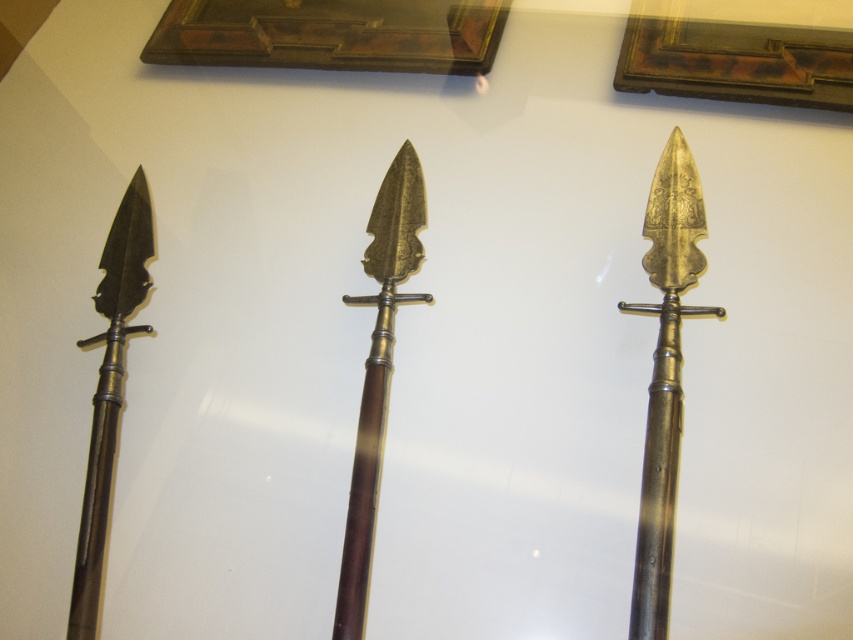
Question: Which is nearer to the gold polished metal spear at center?

Choices:
 (A) matte black spear at left
 (B) gold polished spear at right

Answer: (A)

Question: Does gold polished metal spear at center lie in front of matte black spear at left?

Choices:
 (A) yes
 (B) no

Answer: (A)

Question: Which is farther from the gold polished spear at right?

Choices:
 (A) gold polished metal spear at center
 (B) matte black spear at left

Answer: (B)

Question: Which object is farther from the camera taking this photo?

Choices:
 (A) gold polished metal spear at center
 (B) gold polished spear at right

Answer: (A)

Question: From the image, what is the correct spatial relationship of gold polished spear at right in relation to gold polished metal spear at center?

Choices:
 (A) below
 (B) above

Answer: (B)

Question: In this image, where is gold polished metal spear at center located relative to matte black spear at left?

Choices:
 (A) below
 (B) above

Answer: (B)